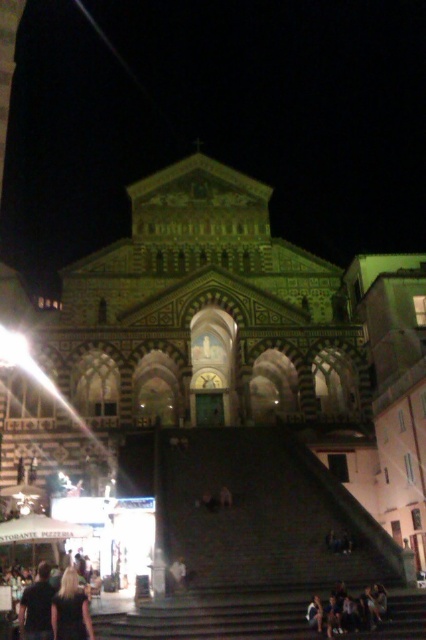
You are standing at the bottom of the cathedral steps and see the black fabric at lower left and the dark brown leather jacket at lower left. Which item is positioned higher up the steps?

The black fabric at lower left is above the dark brown leather jacket at lower left, so the black fabric at lower left is positioned higher up the steps.

You are standing at the base of the cathedral steps and see the dark blue jeans at lower center and a camera. Which object is closer to you?

The dark blue jeans at lower center is closer to you than the camera because they are 50.15 meters apart from each other.